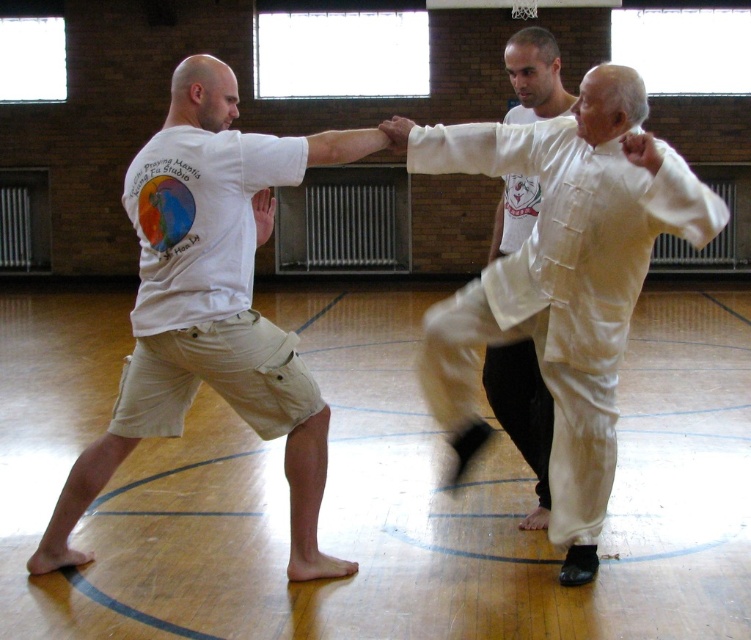
You are observing a martial arts demonstration in the gymnasium. There are two participants wearing white silk pants at right and white silk shirt at center. Which participant is positioned closer to the left side of the scene?

The white silk pants at right is positioned to the left of the white silk shirt at center, so the participant wearing white silk pants at right is closer to the left side of the scene.

Based on the photo, you are standing in the gymnasium and see two points marked on the floor at coordinates point (537, 244) and point (538, 449). Which point is closer to you?

Point (537, 244) is closer to the viewer than point (538, 449).

You are an observer standing at the entrance of the gymnasium. You see the white silk pants at right. Where exactly are they located in the gymnasium?

The white silk pants at right are located at point (559,280) in the gymnasium.